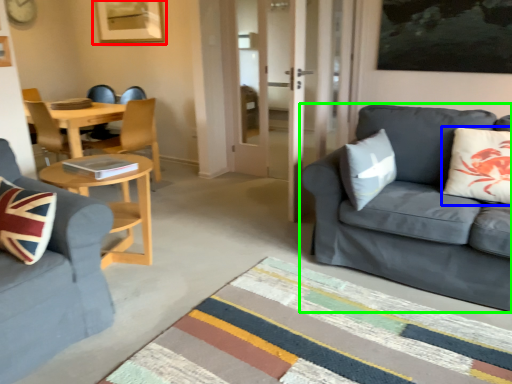
Question: Considering the real-world distances, which object is farthest from picture frame (highlighted by a red box)? pillow (highlighted by a blue box) or studio couch (highlighted by a green box)?

Choices:
 (A) pillow
 (B) studio couch

Answer: (A)